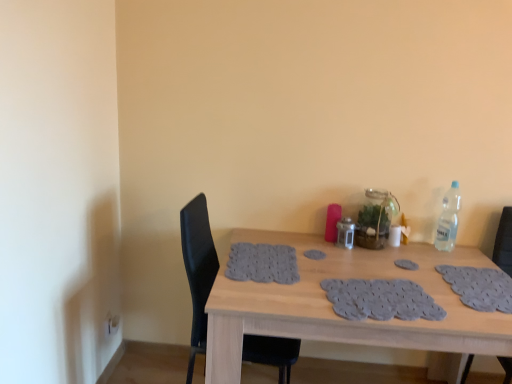
The width and height of the screenshot is (512, 384). Find the location of `free spot behind gray fabric placemat at center, placed as the second footprint when sorted from left to right`. free spot behind gray fabric placemat at center, placed as the second footprint when sorted from left to right is located at coordinates (399, 254).